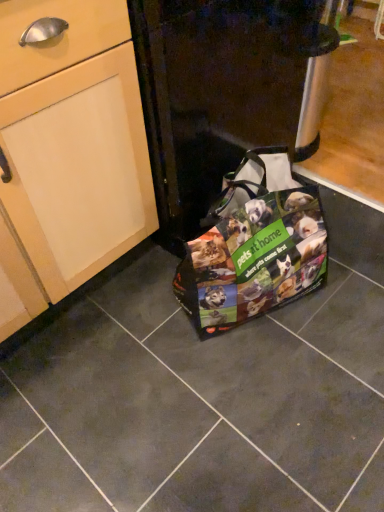
Describe the element at coordinates (224, 91) in the screenshot. This screenshot has width=384, height=512. I see `black plastic trash can at lower center` at that location.

Locate an element on the screen. The width and height of the screenshot is (384, 512). black plastic trash can at lower center is located at coordinates (224, 91).

In the scene shown: In order to face black plastic trash can at lower center, should I rotate leftwards or rightwards?

A 2.906 degree turn to the left will do.

At what (x,y) coordinates should I click in order to perform the action: click on black plastic trash can at lower center. Please return your answer as a coordinate pair (x, y). Looking at the image, I should click on (224, 91).